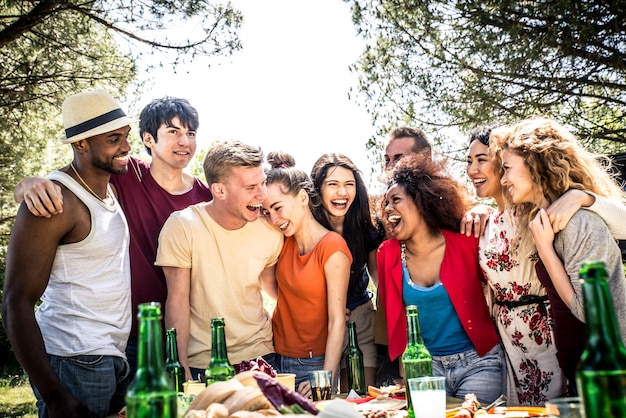
In order to click on bottles in this screenshot , I will do `click(140, 379)`, `click(173, 370)`, `click(220, 361)`, `click(351, 366)`, `click(416, 360)`, `click(595, 385)`.